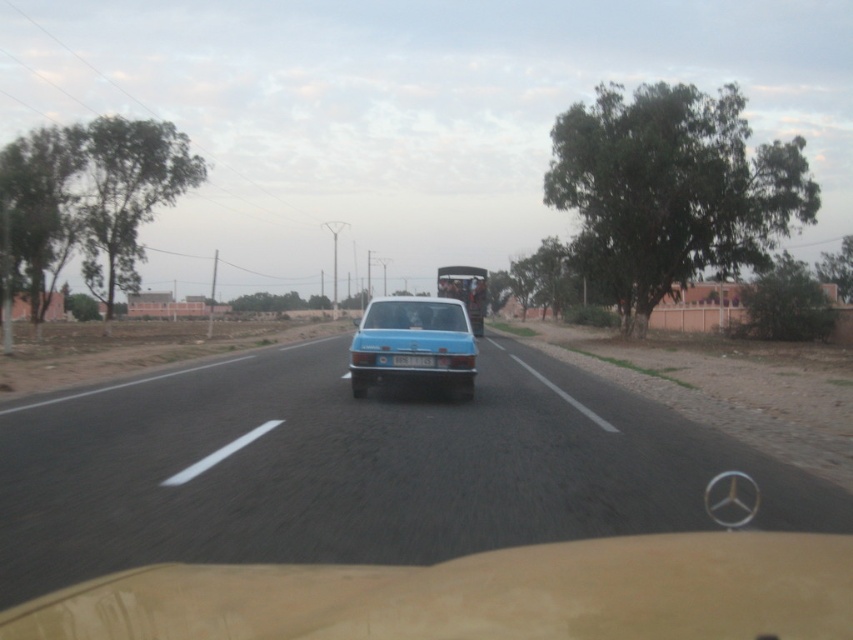
Which is behind, point (280, 540) or point (440, 300)?

Point (440, 300)

Between point (195, 424) and point (451, 305), which one is positioned in front?

Point (195, 424) is in front.

Does point (572, 522) come behind point (468, 324)?

No, it is not.

The height and width of the screenshot is (640, 853). I want to click on blue glossy car at center, so click(357, 467).

Is point (370, 369) less distant than point (410, 356)?

No.

Can you confirm if blue matte sedan at center is positioned below blue plastic license plate at center?

Incorrect, blue matte sedan at center is not positioned below blue plastic license plate at center.

Image resolution: width=853 pixels, height=640 pixels. I want to click on blue matte sedan at center, so click(x=415, y=342).

Find the location of `blue matte sedan at center`. blue matte sedan at center is located at coordinates (415, 342).

Is blue glossy car at center shorter than blue plastic license plate at center?

In fact, blue glossy car at center may be taller than blue plastic license plate at center.

Is point (447, 472) farther from camera compared to point (428, 365)?

No, it is not.

What do you see at coordinates (357, 467) in the screenshot?
I see `blue glossy car at center` at bounding box center [357, 467].

Where is `blue glossy car at center`? The height and width of the screenshot is (640, 853). blue glossy car at center is located at coordinates (357, 467).